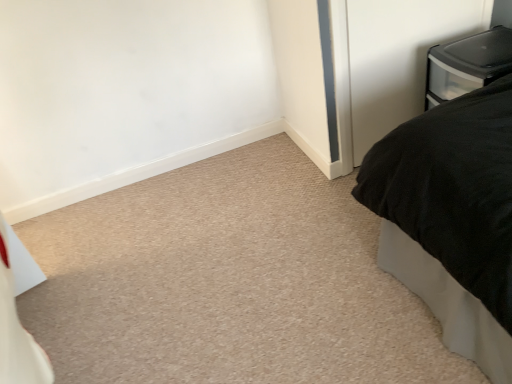
Question: Is black matte bed at right outside clear plastic storage container at upper right?

Choices:
 (A) yes
 (B) no

Answer: (A)

Question: Can you confirm if black matte bed at right is wider than clear plastic storage container at upper right?

Choices:
 (A) no
 (B) yes

Answer: (B)

Question: From the image's perspective, is black matte bed at right under clear plastic storage container at upper right?

Choices:
 (A) yes
 (B) no

Answer: (A)

Question: Is clear plastic storage container at upper right located within black matte bed at right?

Choices:
 (A) yes
 (B) no

Answer: (B)

Question: Does black matte bed at right have a lesser width compared to clear plastic storage container at upper right?

Choices:
 (A) yes
 (B) no

Answer: (B)

Question: Is black matte bed at right taller or shorter than clear plastic storage container at upper right?

Choices:
 (A) short
 (B) tall

Answer: (B)

Question: Considering their positions, is black matte bed at right located in front of or behind clear plastic storage container at upper right?

Choices:
 (A) front
 (B) behind

Answer: (A)

Question: Considering the relative positions of black matte bed at right and clear plastic storage container at upper right in the image provided, is black matte bed at right to the left or to the right of clear plastic storage container at upper right?

Choices:
 (A) left
 (B) right

Answer: (A)

Question: Choose the correct answer: Is black matte bed at right inside clear plastic storage container at upper right or outside it?

Choices:
 (A) inside
 (B) outside

Answer: (B)

Question: Is point (387, 92) closer or farther from the camera than point (432, 117)?

Choices:
 (A) closer
 (B) farther

Answer: (B)

Question: From the image's perspective, relative to black matte bed at right, is clear plastic drawer at upper right above or below?

Choices:
 (A) below
 (B) above

Answer: (B)

Question: From a real-world perspective, is clear plastic drawer at upper right physically located above or below black matte bed at right?

Choices:
 (A) above
 (B) below

Answer: (A)

Question: Is clear plastic drawer at upper right inside or outside of black matte bed at right?

Choices:
 (A) outside
 (B) inside

Answer: (A)

Question: From their relative heights in the image, would you say clear plastic drawer at upper right is taller or shorter than clear plastic storage container at upper right?

Choices:
 (A) tall
 (B) short

Answer: (A)

Question: From the image's perspective, relative to clear plastic storage container at upper right, is clear plastic drawer at upper right above or below?

Choices:
 (A) below
 (B) above

Answer: (B)